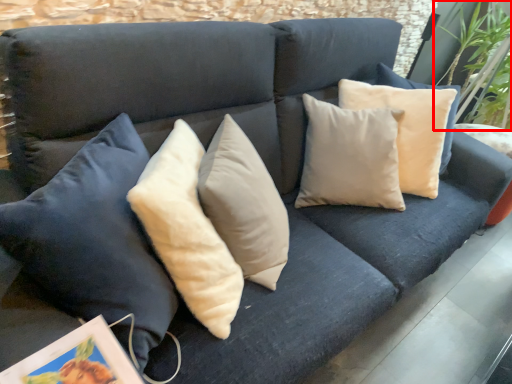
Question: From the image's perspective, considering the relative positions of plant (annotated by the red box) and picture frame in the image provided, where is plant (annotated by the red box) located with respect to the staircase?

Choices:
 (A) below
 (B) above

Answer: (B)